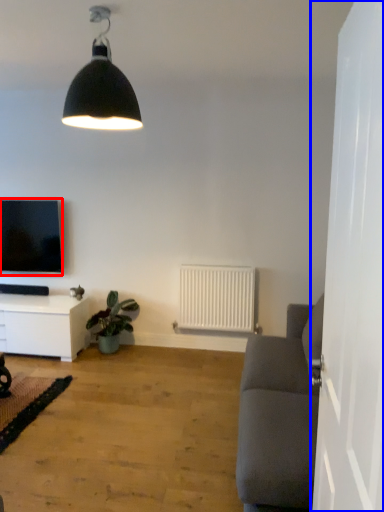
Question: Which point is closer to the camera, television (highlighted by a red box) or side (highlighted by a blue box)?

Choices:
 (A) television
 (B) side

Answer: (B)